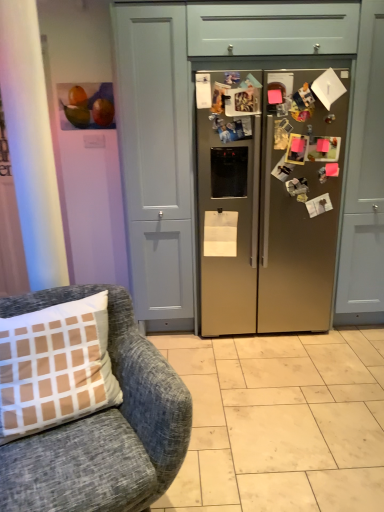
Question: Is satin metallic refrigerator at center turned away from textured gray fabric chair at lower left?

Choices:
 (A) no
 (B) yes

Answer: (A)

Question: Is textured gray fabric chair at lower left inside satin metallic refrigerator at center?

Choices:
 (A) yes
 (B) no

Answer: (B)

Question: Is satin metallic refrigerator at center positioned beyond the bounds of textured gray fabric chair at lower left?

Choices:
 (A) yes
 (B) no

Answer: (A)

Question: Considering the relative sizes of satin metallic refrigerator at center and textured gray fabric chair at lower left in the image provided, is satin metallic refrigerator at center bigger than textured gray fabric chair at lower left?

Choices:
 (A) yes
 (B) no

Answer: (A)

Question: From a real-world perspective, is satin metallic refrigerator at center positioned over textured gray fabric chair at lower left based on gravity?

Choices:
 (A) no
 (B) yes

Answer: (B)

Question: Considering the positions of matte gray cabinet at left and satin gold refrigerator at center in the image, is matte gray cabinet at left wider or thinner than satin gold refrigerator at center?

Choices:
 (A) wide
 (B) thin

Answer: (B)

Question: Is matte gray cabinet at left taller or shorter than satin gold refrigerator at center?

Choices:
 (A) tall
 (B) short

Answer: (A)

Question: Is matte gray cabinet at left to the left or to the right of satin gold refrigerator at center in the image?

Choices:
 (A) left
 (B) right

Answer: (A)

Question: From a real-world perspective, is matte gray cabinet at left physically located above or below satin gold refrigerator at center?

Choices:
 (A) above
 (B) below

Answer: (A)

Question: Is matte gray cabinet at left taller or shorter than matte gray drawer at upper center?

Choices:
 (A) tall
 (B) short

Answer: (A)

Question: From the image's perspective, is matte gray cabinet at left positioned above or below matte gray drawer at upper center?

Choices:
 (A) above
 (B) below

Answer: (B)

Question: Considering the positions of point (183, 185) and point (259, 33), is point (183, 185) closer or farther from the camera than point (259, 33)?

Choices:
 (A) farther
 (B) closer

Answer: (A)

Question: From a real-world perspective, is matte gray cabinet at left positioned above or below matte gray drawer at upper center?

Choices:
 (A) above
 (B) below

Answer: (B)

Question: Relative to satin metallic refrigerator at center, is matte gray cabinet at left in front or behind?

Choices:
 (A) front
 (B) behind

Answer: (A)

Question: Considering the positions of matte gray cabinet at left and satin metallic refrigerator at center in the image, is matte gray cabinet at left taller or shorter than satin metallic refrigerator at center?

Choices:
 (A) tall
 (B) short

Answer: (A)